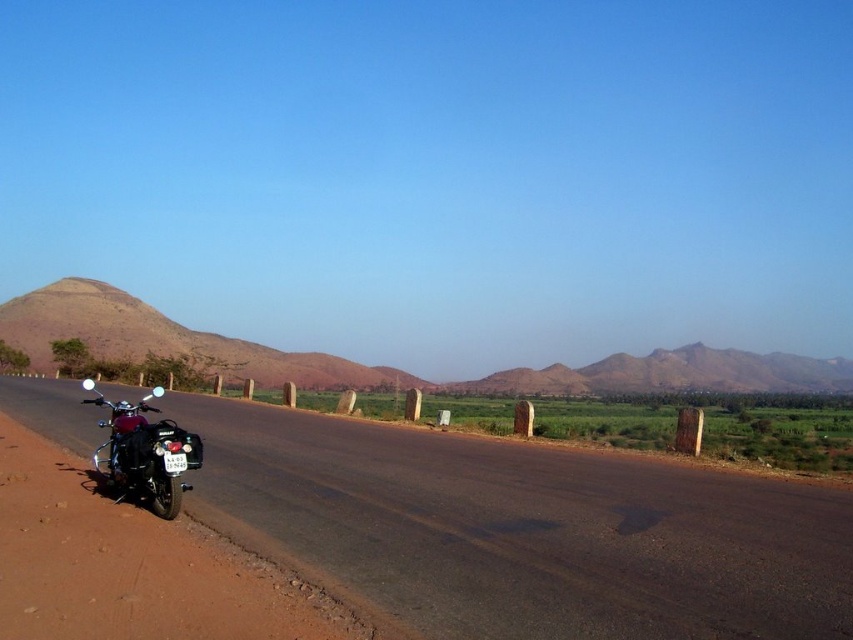
You are a hiker planning to take a photo of the brown matte mountain at left. You are currently standing on the brown dirt track at lower left. Which direction should you face to ensure the mountain is fully visible in your camera frame?

Since the brown dirt track at lower left is smaller in size than the brown matte mountain at left, you should face towards the mountain to ensure it is fully visible in your camera frame.

You are standing at the center of the two lane road and looking towards the direction the black motorcycle with red accents is facing. Which direction should you turn to see the brown matte mountain at left?

You should turn to the left to see the brown matte mountain at left because the motorcycle is facing towards the left side of the frame, and the mountain is located at the left direction from your position.

You are standing on the road and see the brown matte mountain at left and the shiny chrome motorcycle at left. Which object is closer to you?

The brown matte mountain at left is closer to you because it is positioned further to the viewer than the shiny chrome motorcycle at left.